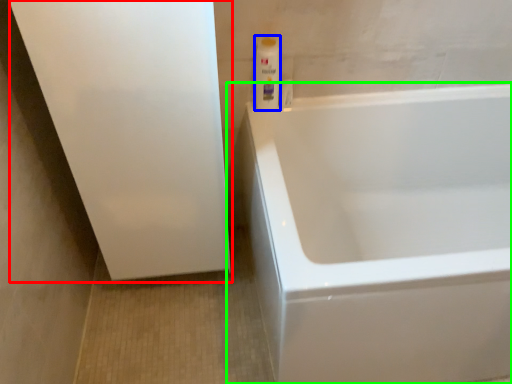
Question: Based on their relative distances, which object is farther from screen door (highlighted by a red box)? Choose from cleaning product (highlighted by a blue box) and bathtub (highlighted by a green box).

Choices:
 (A) cleaning product
 (B) bathtub

Answer: (B)